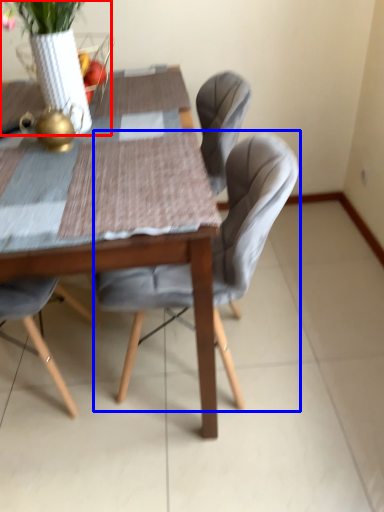
Question: Which object appears farthest to the camera in this image, floral arrangement (highlighted by a red box) or chair (highlighted by a blue box)?

Choices:
 (A) floral arrangement
 (B) chair

Answer: (B)